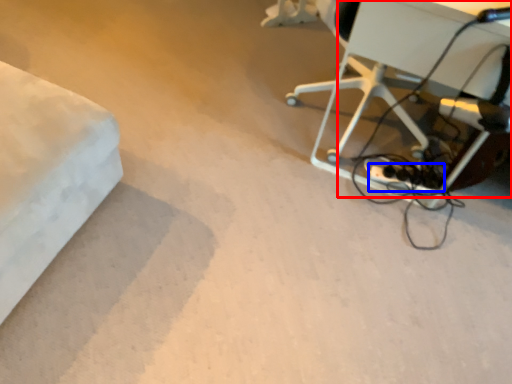
Question: Which point is further to the camera, table (highlighted by a red box) or extension cord (highlighted by a blue box)?

Choices:
 (A) table
 (B) extension cord

Answer: (B)